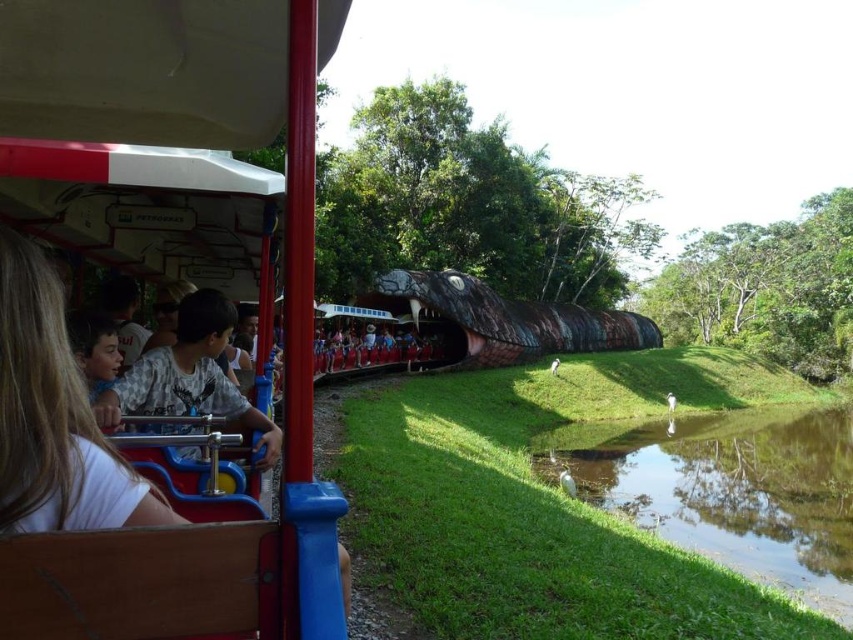
Can you confirm if white matte shirt at left is positioned to the left of matte red shirt at center?

In fact, white matte shirt at left is to the right of matte red shirt at center.

Does white matte shirt at left have a lesser width compared to matte red shirt at center?

Yes, white matte shirt at left is thinner than matte red shirt at center.

Between point (172, 401) and point (402, 364), which one is positioned behind?

Point (402, 364)

Find the location of `white matte shirt at left`. white matte shirt at left is located at coordinates (189, 376).

Which is behind, point (582, 429) or point (421, 340)?

Positioned behind is point (421, 340).

Is green grassy river at lower right behind matte red shirt at center?

That is False.

Does point (787, 428) lie in front of point (367, 337)?

No, it is behind (367, 337).

I want to click on green grassy river at lower right, so click(x=729, y=490).

Is point (664, 472) positioned in front of point (148, 384)?

No, (664, 472) is behind (148, 384).

Is green grassy river at lower right to the right of white matte shirt at left from the viewer's perspective?

Yes, green grassy river at lower right is to the right of white matte shirt at left.

Between point (833, 474) and point (204, 304), which one is positioned behind?

Positioned behind is point (833, 474).

Where is `green grassy river at lower right`? The image size is (853, 640). green grassy river at lower right is located at coordinates (729, 490).